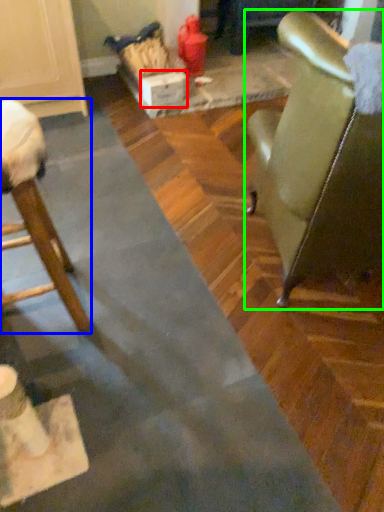
Question: Which is nearer to the cardboard box (highlighted by a red box)? chair (highlighted by a blue box) or chair (highlighted by a green box).

Choices:
 (A) chair
 (B) chair

Answer: (A)